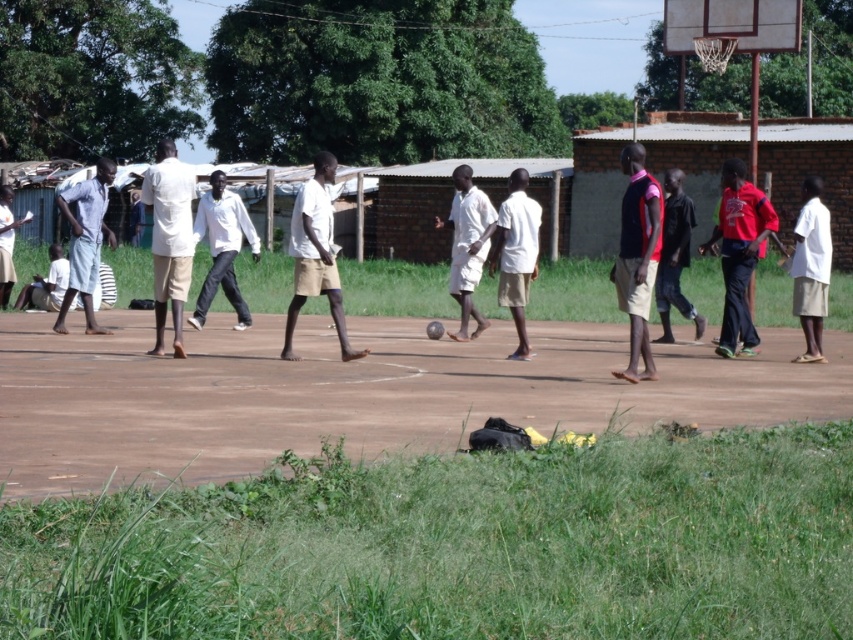
Can you confirm if white cotton shirt at left is taller than dark red shirt at center?

Indeed, white cotton shirt at left has a greater height compared to dark red shirt at center.

Is white cotton shirt at left closer to camera compared to dark red shirt at center?

Yes.

Locate an element on the screen. The width and height of the screenshot is (853, 640). white cotton shirt at left is located at coordinates (169, 237).

Is brown dirt basketball court at center smaller than dark red shirt at center?

No, brown dirt basketball court at center is not smaller than dark red shirt at center.

Can you confirm if brown dirt basketball court at center is positioned to the right of dark red shirt at center?

No, brown dirt basketball court at center is not to the right of dark red shirt at center.

Which is in front, point (178, 410) or point (689, 317)?

Point (178, 410) is in front.

Identify the location of brown dirt basketball court at center. (355, 394).

Consider the image. How far apart are red matte shirt at right and dark red shirt at center?

35.90 inches

Is point (728, 212) in front of point (664, 316)?

That is True.

The width and height of the screenshot is (853, 640). What are the coordinates of `red matte shirt at right` in the screenshot? It's located at (740, 253).